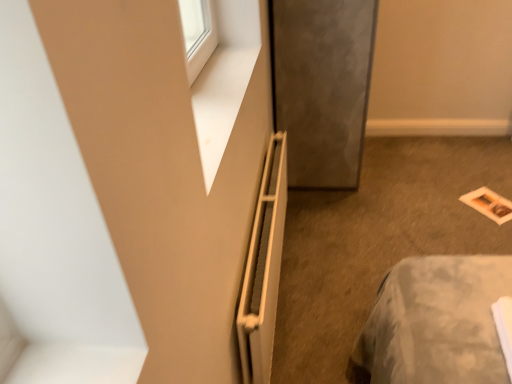
The image size is (512, 384). I want to click on vacant space to the left of matte paper magazine at lower right, so click(446, 205).